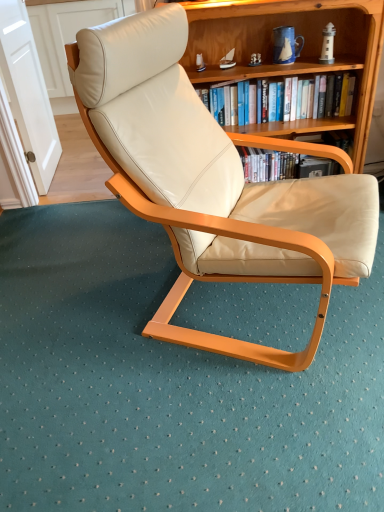
The height and width of the screenshot is (512, 384). Find the location of `vacant space to the left of matte cream leather chair at center`. vacant space to the left of matte cream leather chair at center is located at coordinates (82, 314).